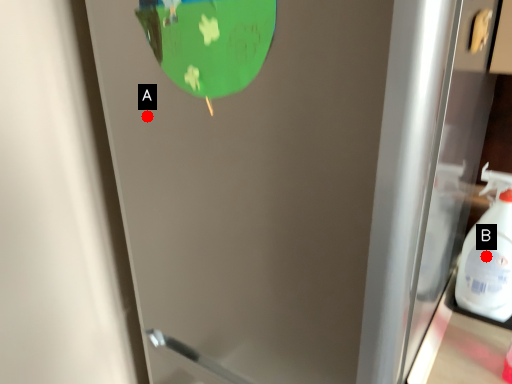
Question: Two points are circled on the image, labeled by A and B beside each circle. Which point is closer to the camera taking this photo?

Choices:
 (A) A is closer
 (B) B is closer

Answer: (A)